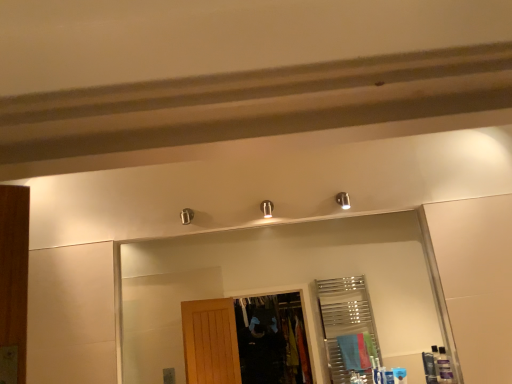
Where is `matte black toiletry at lower right, which is the second toiletry from left to right`? This screenshot has height=384, width=512. matte black toiletry at lower right, which is the second toiletry from left to right is located at coordinates (429, 368).

This screenshot has width=512, height=384. What do you see at coordinates (429, 368) in the screenshot?
I see `matte black toiletry at lower right, which is the second toiletry from left to right` at bounding box center [429, 368].

I want to click on translucent plastic bottles at lower right, which is counted as the 3th toiletry, starting from the left, so click(x=437, y=366).

Could you measure the distance between translucent plastic bottles at lower right, which is counted as the 3th toiletry, starting from the left, and matte black toiletry at lower right, which is the second toiletry from left to right?

They are 1.23 inches apart.

From a real-world perspective, starting from the translucent plastic bottles at lower right, the 1th toiletry in the right-to-left sequence, which toiletry is the 1st one below it? Please provide its 2D coordinates.

[(429, 368)]

Based on the photo, is translucent plastic bottles at lower right, which is counted as the 3th toiletry, starting from the left, outside of matte black toiletry at lower right, arranged as the 2th toiletry when viewed from the right?

Yes.

Is translucent plastic bottles at lower right, the 1th toiletry in the right-to-left sequence, aimed at matte black toiletry at lower right, arranged as the 2th toiletry when viewed from the right?

No.

Considering the positions of point (426, 363) and point (439, 377), is point (426, 363) closer or farther from the camera than point (439, 377)?

Point (426, 363) is farther from the camera than point (439, 377).

Would you say matte black toiletry at lower right, arranged as the 2th toiletry when viewed from the right, contains translucent plastic bottles at lower right, the 1th toiletry in the right-to-left sequence?

No, matte black toiletry at lower right, arranged as the 2th toiletry when viewed from the right, does not contain translucent plastic bottles at lower right, the 1th toiletry in the right-to-left sequence.

Is matte black toiletry at lower right, arranged as the 2th toiletry when viewed from the right, oriented towards translucent plastic bottles at lower right, which is counted as the 3th toiletry, starting from the left?

No, matte black toiletry at lower right, arranged as the 2th toiletry when viewed from the right, is not turned towards translucent plastic bottles at lower right, which is counted as the 3th toiletry, starting from the left.

Does point (437, 358) come behind point (123, 245)?

No, (437, 358) is closer to viewer.

Locate an element on the screen. mirror that appears behind the translucent plastic bottles at lower right, which is counted as the 3th toiletry, starting from the left is located at coordinates (277, 284).

From the image's perspective, which one is positioned higher, translucent plastic bottles at lower right, the 1th toiletry in the right-to-left sequence, or clear glass mirror at upper center?

clear glass mirror at upper center appears higher in the image.

From a real-world perspective, does matte black toiletry at lower right, arranged as the 2th toiletry when viewed from the right, stand above blue plastic toiletry at lower right, the 1th toiletry viewed from the left?

Yes, from a real-world perspective, matte black toiletry at lower right, arranged as the 2th toiletry when viewed from the right, is over blue plastic toiletry at lower right, the 1th toiletry viewed from the left

Is matte black toiletry at lower right, which is the second toiletry from left to right, looking in the opposite direction of blue plastic toiletry at lower right, the 1th toiletry viewed from the left?

No.

Looking at the image, does matte black toiletry at lower right, arranged as the 2th toiletry when viewed from the right, seem bigger or smaller compared to blue plastic toiletry at lower right, arranged as the third toiletry when viewed from the right?

Considering their sizes, matte black toiletry at lower right, arranged as the 2th toiletry when viewed from the right, takes up more space than blue plastic toiletry at lower right, arranged as the third toiletry when viewed from the right.

From a real-world perspective, relative to clear glass mirror at upper center, is blue plastic toiletry at lower right, the 1th toiletry viewed from the left, vertically above or below?

Clearly, from a real-world perspective, blue plastic toiletry at lower right, the 1th toiletry viewed from the left, is below clear glass mirror at upper center.

Is clear glass mirror at upper center located within blue plastic toiletry at lower right, the 1th toiletry viewed from the left?

No, clear glass mirror at upper center is not surrounded by blue plastic toiletry at lower right, the 1th toiletry viewed from the left.

From the image's perspective, which one is positioned higher, blue plastic toiletry at lower right, arranged as the third toiletry when viewed from the right, or clear glass mirror at upper center?

clear glass mirror at upper center appears higher in the image.

How far apart are clear glass mirror at upper center and blue plastic toiletry at lower right, the 1th toiletry viewed from the left?

They are 2.57 meters apart.

Considering the relative sizes of clear glass mirror at upper center and blue plastic toiletry at lower right, the 1th toiletry viewed from the left, in the image provided, is clear glass mirror at upper center wider than blue plastic toiletry at lower right, the 1th toiletry viewed from the left,?

Yes.

Does point (332, 263) come closer to viewer compared to point (402, 383)?

No, it is not.

From their relative heights in the image, would you say clear glass mirror at upper center is taller or shorter than blue plastic toiletry at lower right, arranged as the third toiletry when viewed from the right?

In the image, clear glass mirror at upper center appears to be taller than blue plastic toiletry at lower right, arranged as the third toiletry when viewed from the right.

Consider the image. Considering the relative positions of blue plastic toiletry at lower right, arranged as the third toiletry when viewed from the right, and translucent plastic bottles at lower right, the 1th toiletry in the right-to-left sequence, in the image provided, is blue plastic toiletry at lower right, arranged as the third toiletry when viewed from the right, to the right of translucent plastic bottles at lower right, the 1th toiletry in the right-to-left sequence, from the viewer's perspective?

In fact, blue plastic toiletry at lower right, arranged as the third toiletry when viewed from the right, is to the left of translucent plastic bottles at lower right, the 1th toiletry in the right-to-left sequence.

From a real-world perspective, relative to translucent plastic bottles at lower right, which is counted as the 3th toiletry, starting from the left, is blue plastic toiletry at lower right, arranged as the third toiletry when viewed from the right, vertically above or below?

blue plastic toiletry at lower right, arranged as the third toiletry when viewed from the right, is below translucent plastic bottles at lower right, which is counted as the 3th toiletry, starting from the left.

Are blue plastic toiletry at lower right, the 1th toiletry viewed from the left, and translucent plastic bottles at lower right, the 1th toiletry in the right-to-left sequence, far apart?

Actually, blue plastic toiletry at lower right, the 1th toiletry viewed from the left, and translucent plastic bottles at lower right, the 1th toiletry in the right-to-left sequence, are a little close together.

From a real-world perspective, which toiletry is the 2nd one above the blue plastic toiletry at lower right, the 1th toiletry viewed from the left? Please provide its 2D coordinates.

[(437, 366)]

In order to click on the 1st toiletry to the left when counting from the translucent plastic bottles at lower right, the 1th toiletry in the right-to-left sequence in this screenshot , I will do 429,368.

This screenshot has height=384, width=512. Find the location of `toiletry that is the 2nd one when counting forward from the matte black toiletry at lower right, which is the second toiletry from left to right`. toiletry that is the 2nd one when counting forward from the matte black toiletry at lower right, which is the second toiletry from left to right is located at coordinates (437, 366).

From the image, which object appears to be farther from blue plastic toiletry at lower right, the 1th toiletry viewed from the left, clear glass mirror at upper center or translucent plastic bottles at lower right, which is counted as the 3th toiletry, starting from the left?

clear glass mirror at upper center lies further to blue plastic toiletry at lower right, the 1th toiletry viewed from the left, than the other object.

Looking at this image, considering their positions, is blue plastic toiletry at lower right, the 1th toiletry viewed from the left, positioned further to translucent plastic bottles at lower right, the 1th toiletry in the right-to-left sequence, than matte black toiletry at lower right, which is the second toiletry from left to right?

blue plastic toiletry at lower right, the 1th toiletry viewed from the left.

When comparing their distances from translucent plastic bottles at lower right, which is counted as the 3th toiletry, starting from the left, does matte black toiletry at lower right, arranged as the 2th toiletry when viewed from the right, or clear glass mirror at upper center seem closer?

Among the two, matte black toiletry at lower right, arranged as the 2th toiletry when viewed from the right, is located nearer to translucent plastic bottles at lower right, which is counted as the 3th toiletry, starting from the left.

Considering their positions, is translucent plastic bottles at lower right, which is counted as the 3th toiletry, starting from the left, positioned further to matte black toiletry at lower right, arranged as the 2th toiletry when viewed from the right, than clear glass mirror at upper center?

The object further to matte black toiletry at lower right, arranged as the 2th toiletry when viewed from the right, is clear glass mirror at upper center.

Considering their positions, is matte black toiletry at lower right, which is the second toiletry from left to right, positioned closer to clear glass mirror at upper center than translucent plastic bottles at lower right, which is counted as the 3th toiletry, starting from the left?

matte black toiletry at lower right, which is the second toiletry from left to right, is closer to clear glass mirror at upper center.

Looking at the image, which one is located further to blue plastic toiletry at lower right, arranged as the third toiletry when viewed from the right, translucent plastic bottles at lower right, which is counted as the 3th toiletry, starting from the left, or clear glass mirror at upper center?

Among the two, clear glass mirror at upper center is located further to blue plastic toiletry at lower right, arranged as the third toiletry when viewed from the right.

Which object lies nearer to the anchor point blue plastic toiletry at lower right, the 1th toiletry viewed from the left, translucent plastic bottles at lower right, the 1th toiletry in the right-to-left sequence, or matte black toiletry at lower right, which is the second toiletry from left to right?

matte black toiletry at lower right, which is the second toiletry from left to right, is closer to blue plastic toiletry at lower right, the 1th toiletry viewed from the left.

Looking at the image, which one is located further to clear glass mirror at upper center, matte black toiletry at lower right, arranged as the 2th toiletry when viewed from the right, or blue plastic toiletry at lower right, arranged as the third toiletry when viewed from the right?

matte black toiletry at lower right, arranged as the 2th toiletry when viewed from the right, is further to clear glass mirror at upper center.

Locate an element on the screen. The height and width of the screenshot is (384, 512). toiletry situated between blue plastic toiletry at lower right, the 1th toiletry viewed from the left, and translucent plastic bottles at lower right, the 1th toiletry in the right-to-left sequence, from left to right is located at coordinates (429, 368).

Image resolution: width=512 pixels, height=384 pixels. Find the location of `toiletry located between clear glass mirror at upper center and matte black toiletry at lower right, arranged as the 2th toiletry when viewed from the right, in the left-right direction`. toiletry located between clear glass mirror at upper center and matte black toiletry at lower right, arranged as the 2th toiletry when viewed from the right, in the left-right direction is located at coordinates (399, 375).